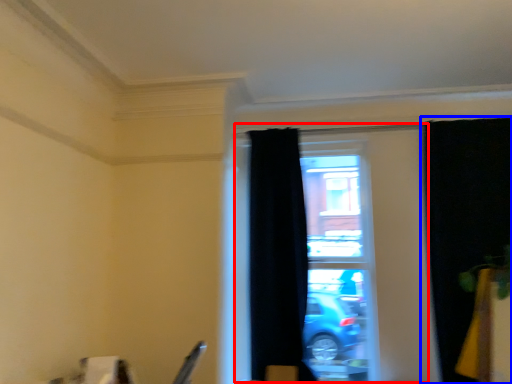
Question: Among these objects, which one is nearest to the camera, window (highlighted by a red box) or curtain (highlighted by a blue box)?

Choices:
 (A) window
 (B) curtain

Answer: (B)